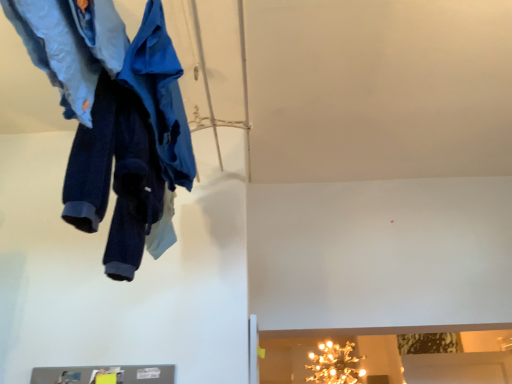
Question: Could you tell me if denim pants at upper left, the 1th trousers from the front, is turned towards navy blue fleece pants at upper left, which is the second trousers from front to back?

Choices:
 (A) yes
 (B) no

Answer: (B)

Question: Is the depth of denim pants at upper left, placed as the second trousers when sorted from back to front, less than that of navy blue fleece pants at upper left, which is the second trousers from front to back?

Choices:
 (A) no
 (B) yes

Answer: (B)

Question: Is denim pants at upper left, placed as the second trousers when sorted from back to front, touching navy blue fleece pants at upper left, which is the first trousers in back-to-front order?

Choices:
 (A) no
 (B) yes

Answer: (A)

Question: Would you consider denim pants at upper left, placed as the second trousers when sorted from back to front, to be distant from navy blue fleece pants at upper left, which is the first trousers in back-to-front order?

Choices:
 (A) no
 (B) yes

Answer: (A)

Question: Does denim pants at upper left, the 1th trousers from the front, have a larger size compared to navy blue fleece pants at upper left, which is the first trousers in back-to-front order?

Choices:
 (A) no
 (B) yes

Answer: (A)

Question: Is gold metallic chandelier at upper center wider or thinner than navy blue fleece pants at upper left, which is the second trousers from front to back?

Choices:
 (A) thin
 (B) wide

Answer: (B)

Question: From a real-world perspective, is gold metallic chandelier at upper center positioned above or below navy blue fleece pants at upper left, which is the first trousers in back-to-front order?

Choices:
 (A) below
 (B) above

Answer: (A)

Question: Considering the relative positions of gold metallic chandelier at upper center and navy blue fleece pants at upper left, which is the first trousers in back-to-front order, in the image provided, is gold metallic chandelier at upper center to the left or to the right of navy blue fleece pants at upper left, which is the first trousers in back-to-front order,?

Choices:
 (A) right
 (B) left

Answer: (A)

Question: From the image's perspective, relative to navy blue fleece pants at upper left, which is the first trousers in back-to-front order, is gold metallic chandelier at upper center above or below?

Choices:
 (A) below
 (B) above

Answer: (A)

Question: Is blue fabric coat at upper left taller or shorter than denim pants at upper left, the 1th trousers from the front?

Choices:
 (A) short
 (B) tall

Answer: (A)

Question: From a real-world perspective, is blue fabric coat at upper left above or below denim pants at upper left, the 1th trousers from the front?

Choices:
 (A) above
 (B) below

Answer: (A)

Question: Relative to denim pants at upper left, placed as the second trousers when sorted from back to front, is blue fabric coat at upper left in front or behind?

Choices:
 (A) front
 (B) behind

Answer: (B)

Question: From the image's perspective, relative to denim pants at upper left, the 1th trousers from the front, is blue fabric coat at upper left above or below?

Choices:
 (A) above
 (B) below

Answer: (B)

Question: Is point (116, 203) closer or farther from the camera than point (169, 100)?

Choices:
 (A) closer
 (B) farther

Answer: (B)

Question: Visually, is navy blue fleece pants at upper left, which is the first trousers in back-to-front order, positioned to the left or to the right of blue fabric coat at upper left?

Choices:
 (A) left
 (B) right

Answer: (A)